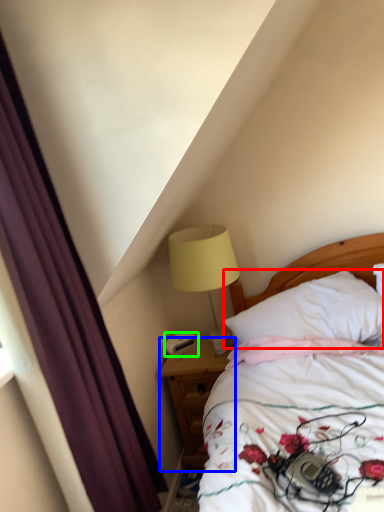
Question: Which object is the closest to the pillow (highlighted by a red box)? Choose among these: nightstand (highlighted by a blue box) or alarm clock (highlighted by a green box).

Choices:
 (A) nightstand
 (B) alarm clock

Answer: (A)